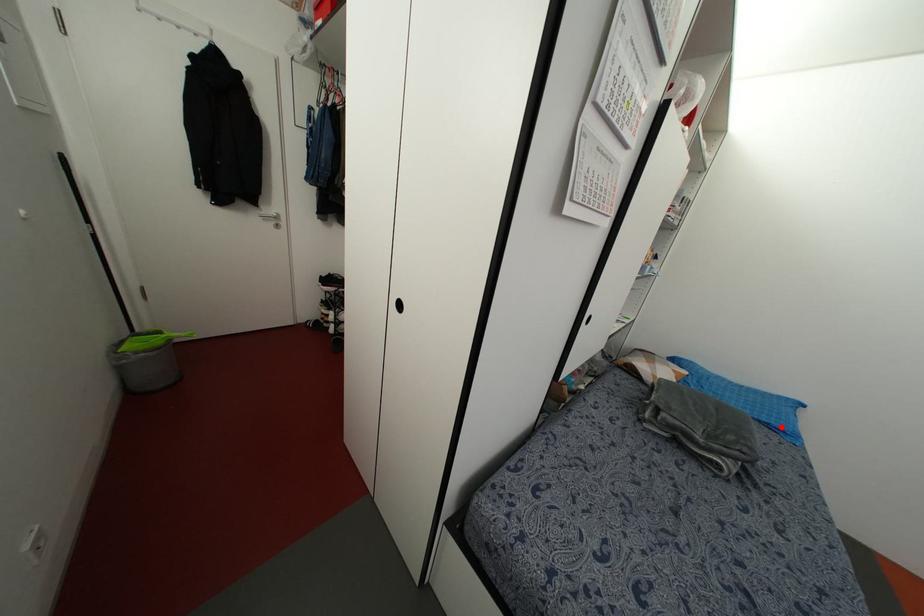
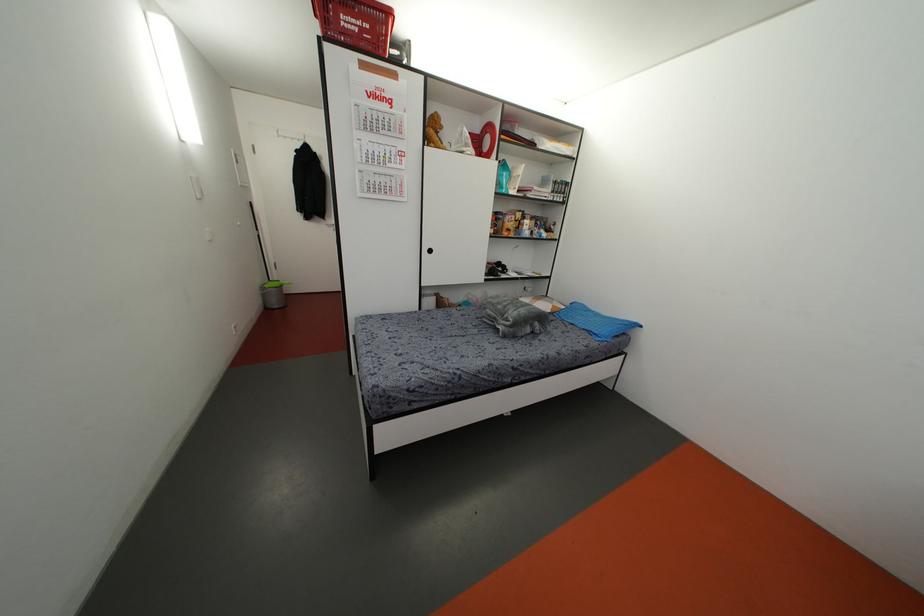
Locate, in the second image, the point that corresponds to the highlighted location in the first image.

(596, 331)